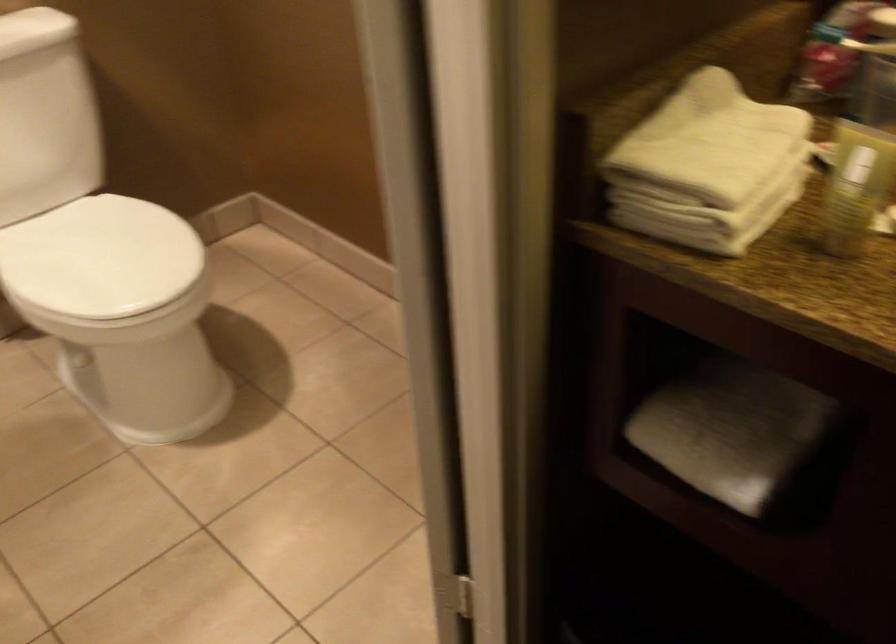
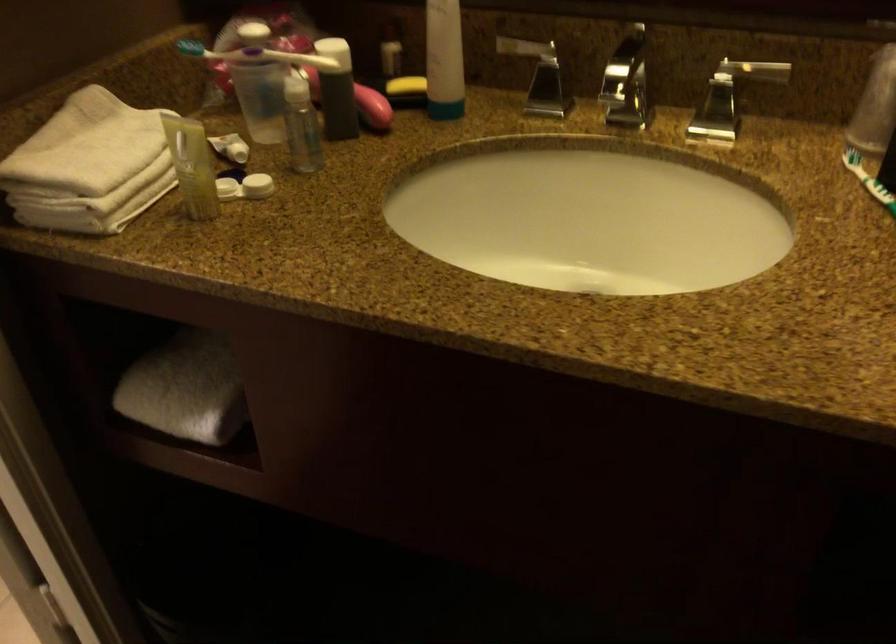
The point at (718, 167) is marked in the first image. Where is the corresponding point in the second image?

(89, 166)